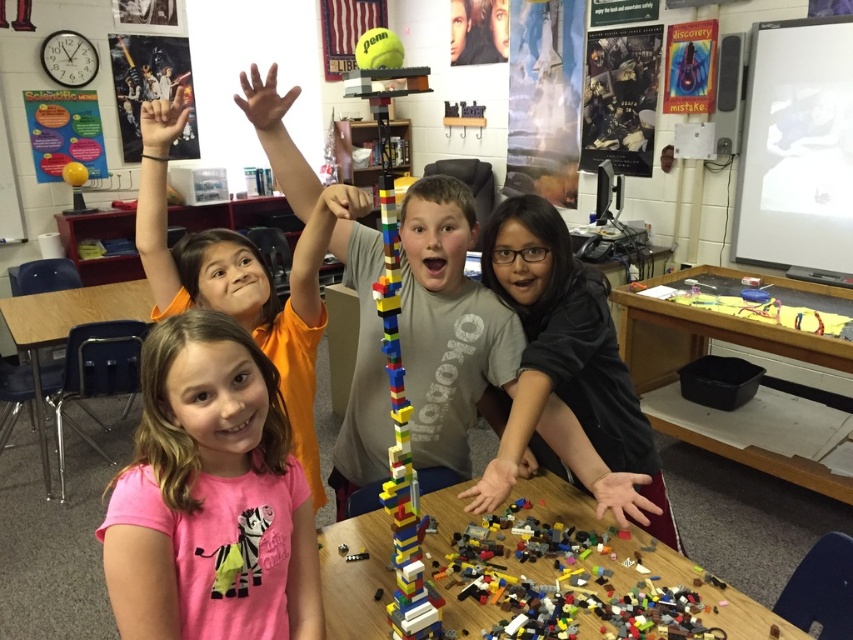
Can you confirm if wooden table at lower right is positioned above smooth skin hand at lower right?

Indeed, wooden table at lower right is positioned over smooth skin hand at lower right.

Can you confirm if wooden table at lower right is thinner than smooth skin hand at lower right?

In fact, wooden table at lower right might be wider than smooth skin hand at lower right.

Is point (850, 310) closer to camera compared to point (590, 493)?

No, it is not.

Locate an element on the screen. The height and width of the screenshot is (640, 853). wooden table at lower right is located at coordinates (741, 406).

Does pink fabric shirt at center lie behind matte black shirt at center?

No, it is in front of matte black shirt at center.

Is pink fabric shirt at center smaller than matte black shirt at center?

Correct, pink fabric shirt at center occupies less space than matte black shirt at center.

At what (x,y) coordinates should I click in order to perform the action: click on pink fabric shirt at center. Please return your answer as a coordinate pair (x, y). Looking at the image, I should click on (212, 497).

You are a GUI agent. You are given a task and a screenshot of the screen. Output one action in this format:
    pyautogui.click(x=<x>, y=<y>)
    Task: Click on the pink fabric shirt at center
    The height and width of the screenshot is (640, 853).
    Given the screenshot: What is the action you would take?
    [x=212, y=497]

In the scene shown: Is wooden table at lower right wider than brown matte hand at upper center?

Correct, the width of wooden table at lower right exceeds that of brown matte hand at upper center.

Which is more to the left, wooden table at lower right or brown matte hand at upper center?

brown matte hand at upper center is more to the left.

Which is in front, point (814, 285) or point (257, 134)?

Point (257, 134) is in front.

Find the location of `wooden table at lower right`. wooden table at lower right is located at coordinates (741, 406).